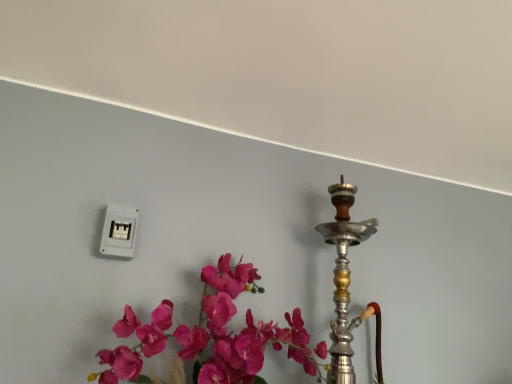
Measure the distance between matte pink flowers at lower left and camera.

They are 90.29 centimeters apart.

What do you see at coordinates (209, 335) in the screenshot? I see `matte pink flowers at lower left` at bounding box center [209, 335].

Image resolution: width=512 pixels, height=384 pixels. What are the coordinates of `matte pink flowers at lower left` in the screenshot? It's located at (209, 335).

At what (x,y) coordinates should I click in order to perform the action: click on matte pink flowers at lower left. Please return your answer as a coordinate pair (x, y). The height and width of the screenshot is (384, 512). Looking at the image, I should click on pyautogui.click(x=209, y=335).